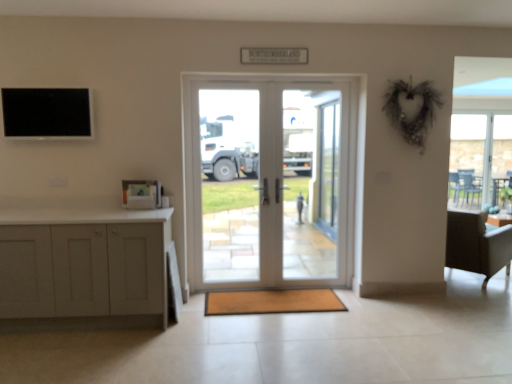
Question: Visually, is white glass door at center positioned to the left or to the right of transparent glass door at center, which ranks as the 2th screen door in right-to-left order?

Choices:
 (A) right
 (B) left

Answer: (B)

Question: Is white glass door at center bigger or smaller than transparent glass door at center, which ranks as the 2th screen door in right-to-left order?

Choices:
 (A) small
 (B) big

Answer: (B)

Question: Estimate the real-world distances between objects in this image. Which object is farther from the transparent glass door at center, arranged as the second screen door when viewed from the back?

Choices:
 (A) clear glass screen door at center, the first screen door from the back
 (B) white matte cabinet at left
 (C) white glass door at center
 (D) light gray fabric chair at right
 (E) black matte screen at upper left

Answer: (E)

Question: Which object is positioned closest to the light gray fabric chair at right?

Choices:
 (A) white matte cabinet at left
 (B) clear glass screen door at center, which ranks as the second screen door in front-to-back order
 (C) transparent glass door at center, which ranks as the 2th screen door in right-to-left order
 (D) white glass door at center
 (E) brown textured mat at center

Answer: (C)